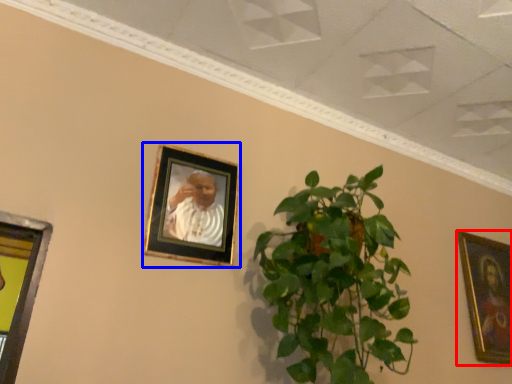
Question: Which object appears closest to the camera in this image, picture frame (highlighted by a red box) or picture frame (highlighted by a blue box)?

Choices:
 (A) picture frame
 (B) picture frame

Answer: (B)